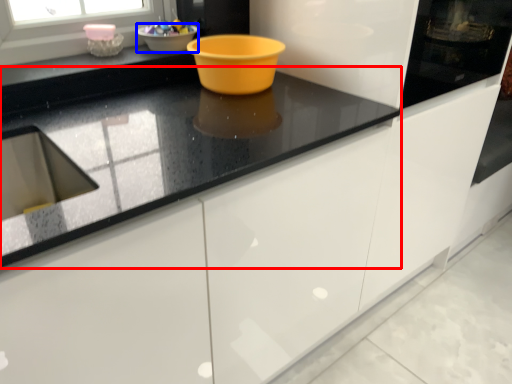
Question: Among these objects, which one is nearest to the camera, countertop (highlighted by a red box) or basin (highlighted by a blue box)?

Choices:
 (A) countertop
 (B) basin

Answer: (A)